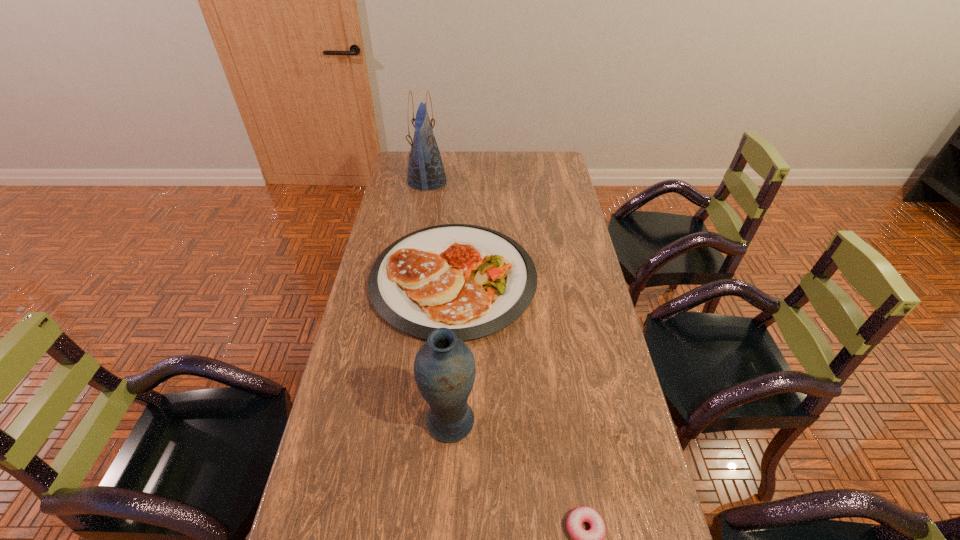
This screenshot has height=540, width=960. Find the location of `shopping bag`. shopping bag is located at coordinates (426, 171).

Where is `the third shortest object`? The height and width of the screenshot is (540, 960). the third shortest object is located at coordinates (444, 367).

You are a GUI agent. You are given a task and a screenshot of the screen. Output one action in this format:
    pyautogui.click(x=<x>, y=<y>)
    Task: Click on the third farthest object
    This screenshot has height=540, width=960.
    Given the screenshot: What is the action you would take?
    pyautogui.click(x=444, y=367)

Where is `the second shortest object`? Image resolution: width=960 pixels, height=540 pixels. the second shortest object is located at coordinates (476, 281).

Identify the location of the second farthest object. (476, 281).

The image size is (960, 540). Identify the location of vacant space located 0.070m on the right of the shopping bag. (462, 180).

The height and width of the screenshot is (540, 960). I want to click on free space located on the left of the third farthest object, so [x=378, y=422].

You are a GUI agent. You are given a task and a screenshot of the screen. Output one action in this format:
    pyautogui.click(x=<x>, y=<y>)
    Task: Click on the vacant space located 0.360m on the back of the third nearest object
    The width and height of the screenshot is (960, 540).
    Given the screenshot: What is the action you would take?
    pyautogui.click(x=460, y=180)

This screenshot has width=960, height=540. Identify the location of object situated at the far edge. (426, 171).

This screenshot has width=960, height=540. Identify the location of shopping bag present at the left edge. (426, 171).